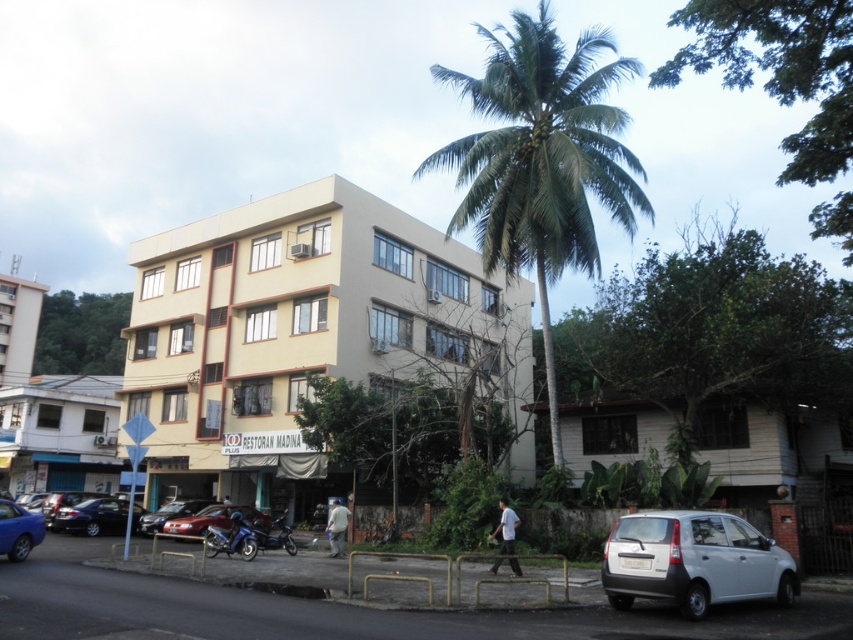
Question: Is the position of metallic blue car at lower left less distant than that of shiny blue motorcycle at center?

Choices:
 (A) no
 (B) yes

Answer: (B)

Question: Among these points, which one is farthest from the camera?

Choices:
 (A) (560, 161)
 (B) (109, 406)
 (C) (273, 518)

Answer: (B)

Question: Is shiny black sedan at lower left to the right of shiny blue motorcycle at center from the viewer's perspective?

Choices:
 (A) no
 (B) yes

Answer: (A)

Question: Among these objects, which one is farthest from the camera?

Choices:
 (A) shiny red car at lower center
 (B) shiny blue motorcycle at center
 (C) beige concrete building at center

Answer: (A)

Question: Does white matte car at lower right have a larger size compared to metallic blue car at lower left?

Choices:
 (A) no
 (B) yes

Answer: (B)

Question: Which object is the farthest from the shiny blue motorcycle at center?

Choices:
 (A) shiny black sedan at lower left
 (B) beige concrete building at center
 (C) white matte building at lower left
 (D) matte black car at center

Answer: (C)